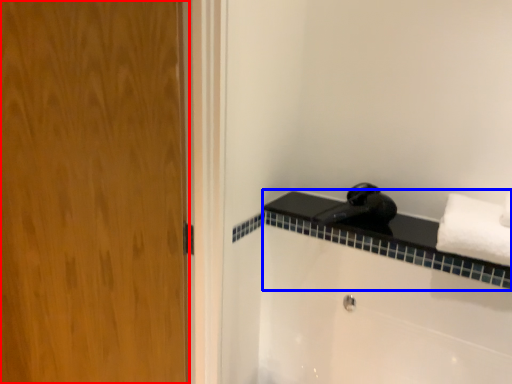
Question: Among these objects, which one is farthest to the camera, door (highlighted by a red box) or balustrade (highlighted by a blue box)?

Choices:
 (A) door
 (B) balustrade

Answer: (B)